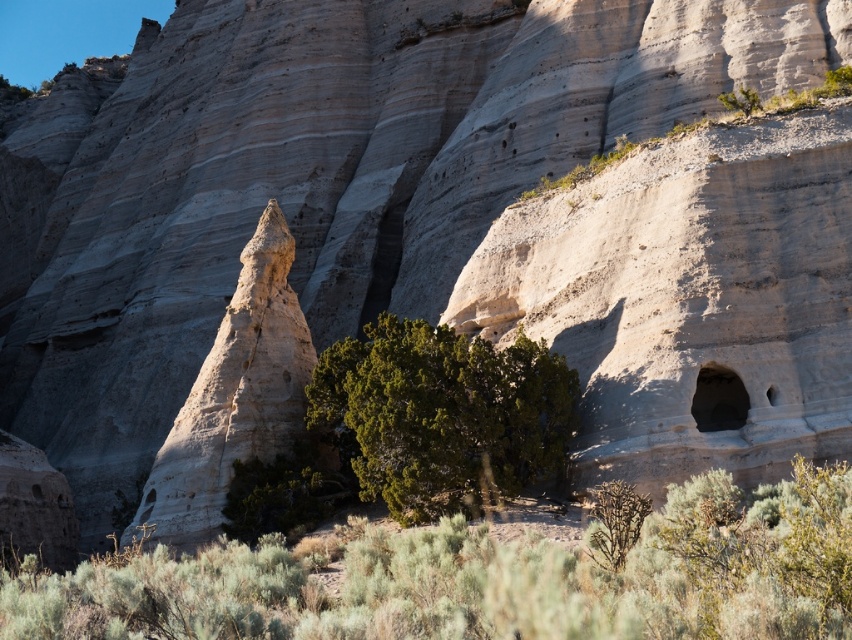
You are standing at the base of the large sandstone cliff and notice the smooth sandstone spire at center. Based on its position, can you determine if the spire is closer to the foreground vegetation or the cliff face?

The smooth sandstone spire at center is located at point coordinates that place it closer to the foreground vegetation than the cliff face.